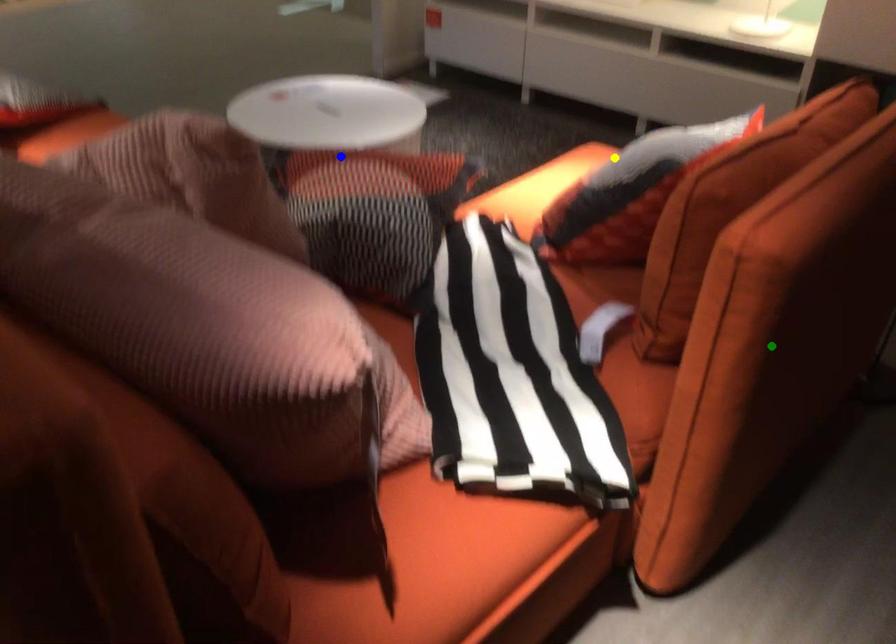
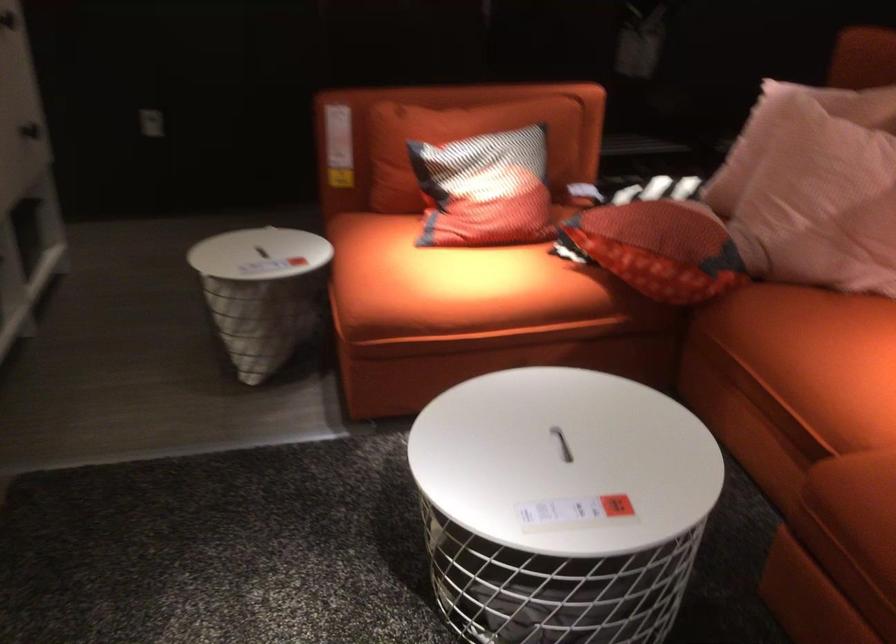
I am providing you with two images of the same scene from different viewpoints. Three points are marked in image1. Which point corresponds to a part or object that is occluded in image2?In image1, three points are marked. Which of them correspond to a part or object that is occluded in image2?Among the three points shown in image1, which one corresponds to a part or object that is no longer visible due to occlusion in image2?

green point cannot be seen in image2.